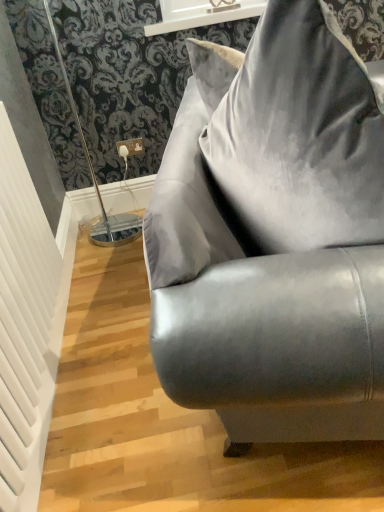
Question: Considering the relative sizes of white glossy window sill at upper center and white textured radiator at left in the image provided, is white glossy window sill at upper center thinner than white textured radiator at left?

Choices:
 (A) yes
 (B) no

Answer: (B)

Question: From the image's perspective, is white glossy window sill at upper center located above white textured radiator at left?

Choices:
 (A) no
 (B) yes

Answer: (B)

Question: From a real-world perspective, is white glossy window sill at upper center physically above white textured radiator at left?

Choices:
 (A) no
 (B) yes

Answer: (B)

Question: Is white glossy window sill at upper center turned away from white textured radiator at left?

Choices:
 (A) no
 (B) yes

Answer: (A)

Question: Is white glossy window sill at upper center shorter than white textured radiator at left?

Choices:
 (A) no
 (B) yes

Answer: (B)

Question: Do you think satin gray couch at center is within white glossy window sill at upper center, or outside of it?

Choices:
 (A) outside
 (B) inside

Answer: (A)

Question: Relative to white glossy window sill at upper center, is satin gray couch at center in front or behind?

Choices:
 (A) front
 (B) behind

Answer: (A)

Question: From a real-world perspective, relative to white glossy window sill at upper center, is satin gray couch at center vertically above or below?

Choices:
 (A) below
 (B) above

Answer: (A)

Question: In terms of width, does satin gray couch at center look wider or thinner when compared to white glossy window sill at upper center?

Choices:
 (A) thin
 (B) wide

Answer: (B)

Question: Looking at their shapes, would you say white glossy window sill at upper center is wider or thinner than white textured radiator at left?

Choices:
 (A) wide
 (B) thin

Answer: (A)

Question: Is white glossy window sill at upper center in front of or behind white textured radiator at left in the image?

Choices:
 (A) behind
 (B) front

Answer: (A)

Question: From a real-world perspective, is white glossy window sill at upper center positioned above or below white textured radiator at left?

Choices:
 (A) below
 (B) above

Answer: (B)

Question: Based on their positions, is white glossy window sill at upper center located to the left or right of white textured radiator at left?

Choices:
 (A) left
 (B) right

Answer: (B)

Question: Considering the positions of white glossy window sill at upper center and satin gray couch at center in the image, is white glossy window sill at upper center bigger or smaller than satin gray couch at center?

Choices:
 (A) small
 (B) big

Answer: (A)

Question: Is white glossy window sill at upper center to the left or to the right of satin gray couch at center in the image?

Choices:
 (A) left
 (B) right

Answer: (A)